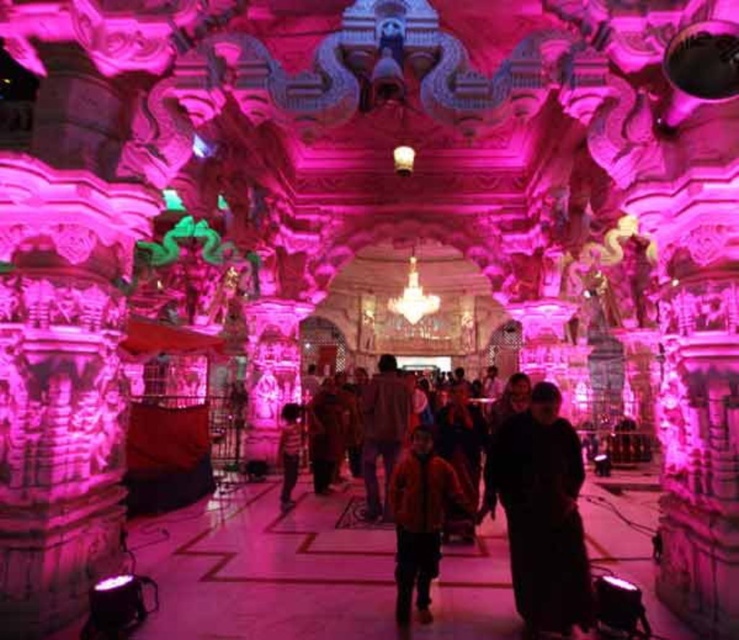
Question: Which of the following is the closest to the observer?

Choices:
 (A) matte white lamp at center
 (B) striped shirt at center

Answer: (B)

Question: Which of these objects is positioned closest to the orange fabric jacket at center?

Choices:
 (A) brown fabric cloth at center
 (B) matte white lamp at center
 (C) striped shirt at center
 (D) black matte dress at center

Answer: (D)

Question: Is black matte dress at center thinner than striped shirt at center?

Choices:
 (A) yes
 (B) no

Answer: (B)

Question: Can you confirm if orange fuzzy jacket at center is positioned below matte white lamp at center?

Choices:
 (A) yes
 (B) no

Answer: (A)

Question: Which point is farther to the camera?

Choices:
 (A) brown fabric cloth at center
 (B) orange fuzzy jacket at center
 (C) striped shirt at center

Answer: (C)

Question: Is brown fabric cloth at center to the right of striped shirt at center from the viewer's perspective?

Choices:
 (A) yes
 (B) no

Answer: (A)